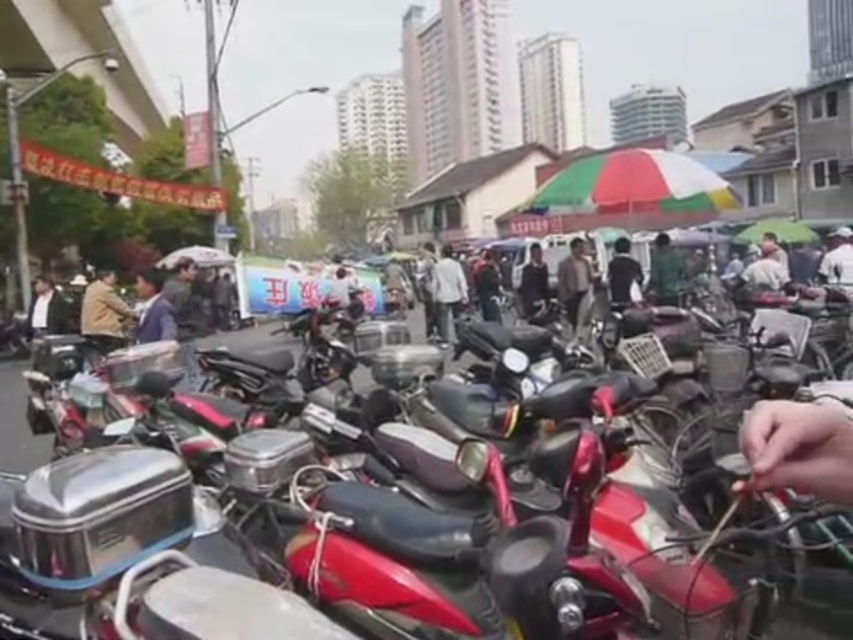
Question: Which point appears closest to the camera in this image?

Choices:
 (A) (97, 346)
 (B) (178, 259)
 (C) (550, 198)

Answer: (A)

Question: Is dark gray jacket at center above transparent plastic umbrella at center?

Choices:
 (A) no
 (B) yes

Answer: (A)

Question: From the image, what is the correct spatial relationship of dark brown leather jacket at center in relation to green matte umbrella at center-right?

Choices:
 (A) left
 (B) right

Answer: (A)

Question: Based on their relative distances, which object is farther from the white fabric shirt at center-right?

Choices:
 (A) white matte jacket at center
 (B) multicolored fabric umbrella at center
 (C) dark gray suit at left

Answer: (C)

Question: Which is farther from the dark brown leather jacket at center?

Choices:
 (A) multicolored fabric umbrella at center
 (B) light brown leather jacket at center
 (C) black matte jacket at center

Answer: (A)

Question: Does brown leather jacket at center appear over dark gray jacket at center?

Choices:
 (A) yes
 (B) no

Answer: (A)